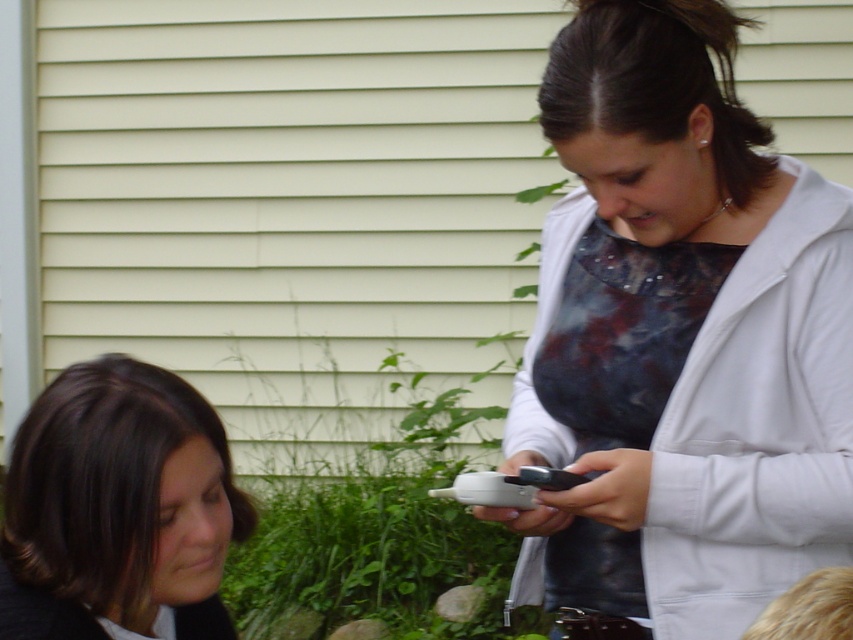
Question: Does dark brown hair at lower left appear over black plastic smartphone at upper right?

Choices:
 (A) no
 (B) yes

Answer: (A)

Question: Which is nearer to the matte white jacket at upper right?

Choices:
 (A) dark brown hair at lower left
 (B) black plastic smartphone at upper right

Answer: (B)

Question: Can you confirm if matte white jacket at upper right is positioned to the right of dark brown hair at lower left?

Choices:
 (A) no
 (B) yes

Answer: (B)

Question: Which point is farther to the camera?

Choices:
 (A) dark brown hair at lower left
 (B) black plastic smartphone at upper right

Answer: (B)

Question: Which object is positioned closest to the black plastic smartphone at upper right?

Choices:
 (A) dark brown hair at lower left
 (B) matte white jacket at upper right

Answer: (B)

Question: Is dark brown hair at lower left above black plastic smartphone at upper right?

Choices:
 (A) yes
 (B) no

Answer: (B)